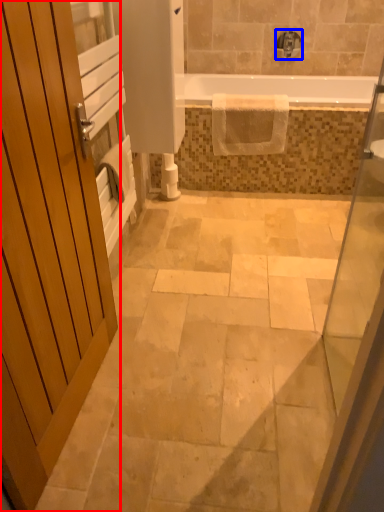
Question: Which of the following is the farthest to the observer, door (highlighted by a red box) or tap (highlighted by a blue box)?

Choices:
 (A) door
 (B) tap

Answer: (B)